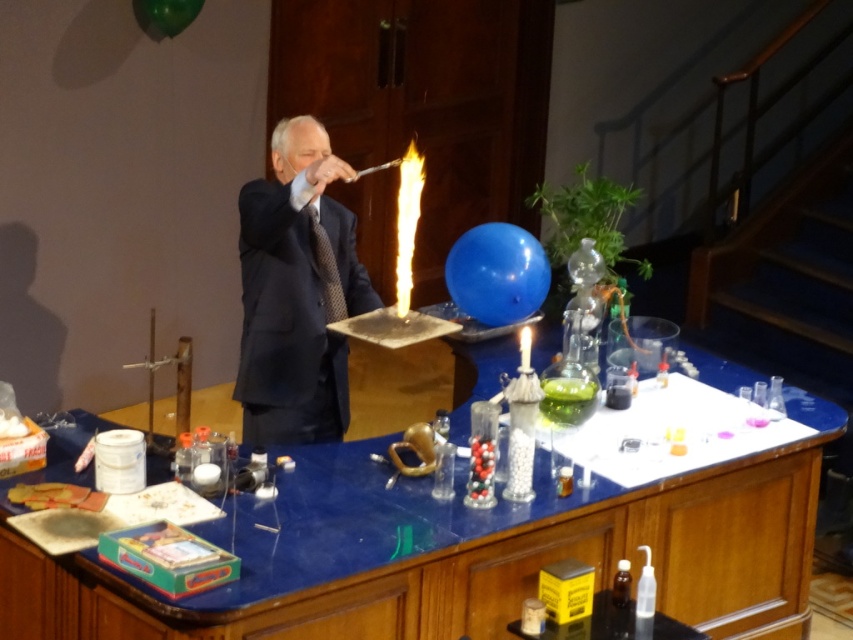
You are standing in the laboratory and need to place a new equipment on the table. What are the exact coordinates of the blue glossy table at center where you should place it?

The blue glossy table at center is located at coordinates point (457, 554), so place the equipment there.

Consider the image. You are standing at the camera position and want to reach point [717,602]. Is the distance less than 15 feet?

The distance between point [717,602] and the camera is 13.18 feet, which is less than 15 feet.